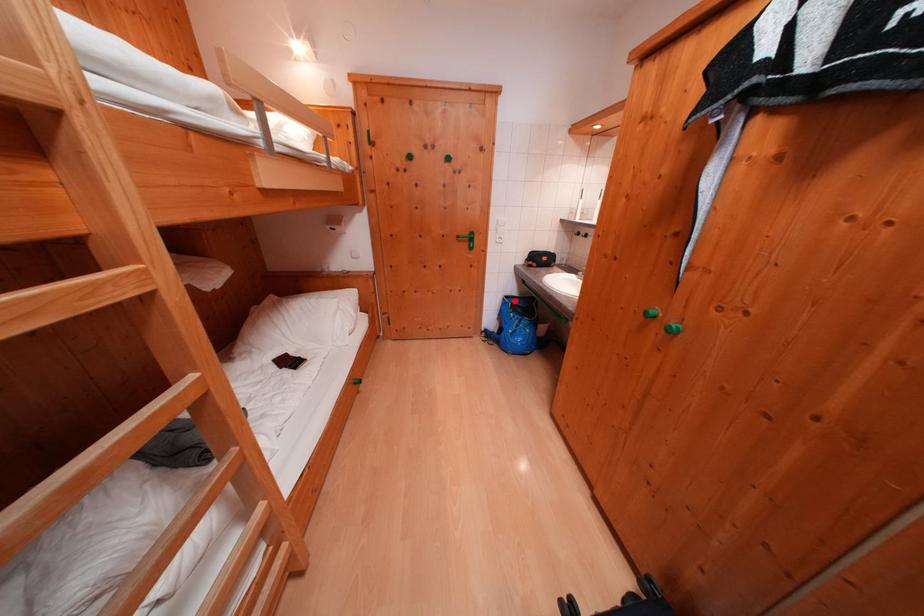
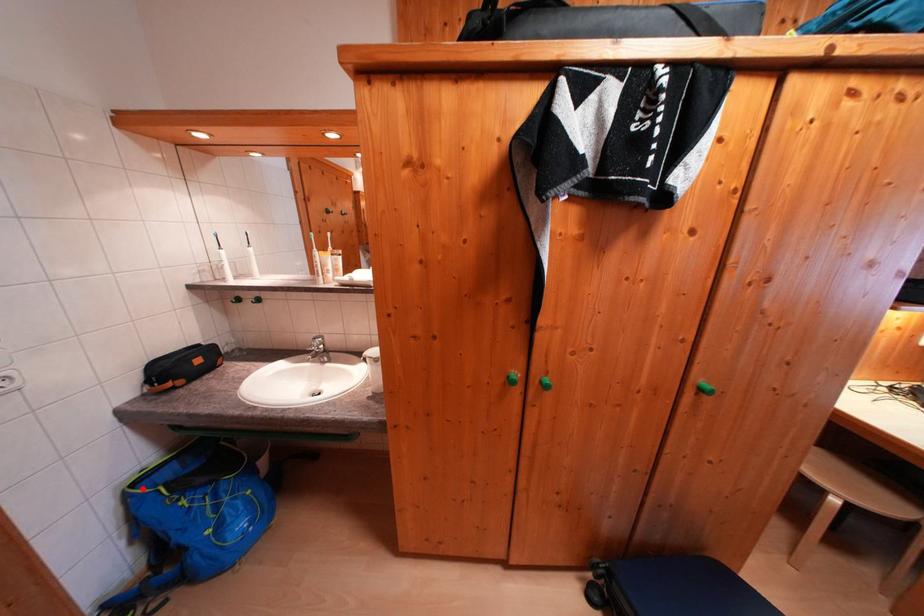
I am providing you with two images of the same scene from different viewpoints. A red point is marked on the first image and another point is marked on the second image. Does the point marked in image1 correspond to the same location as the one in image2?

Yes